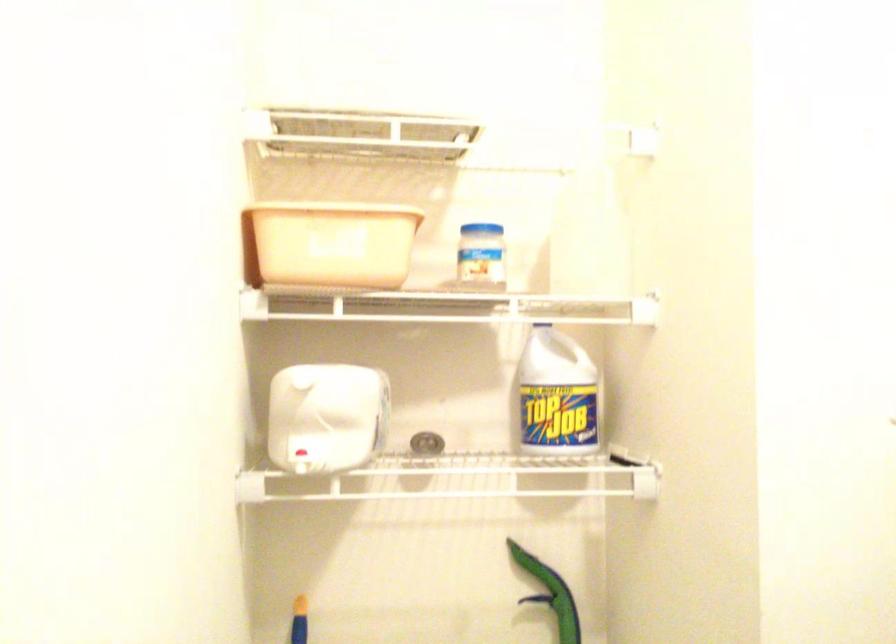
Where would you lift the white bottle handle? Please return your answer as a coordinate pair (x, y).

(556, 395)